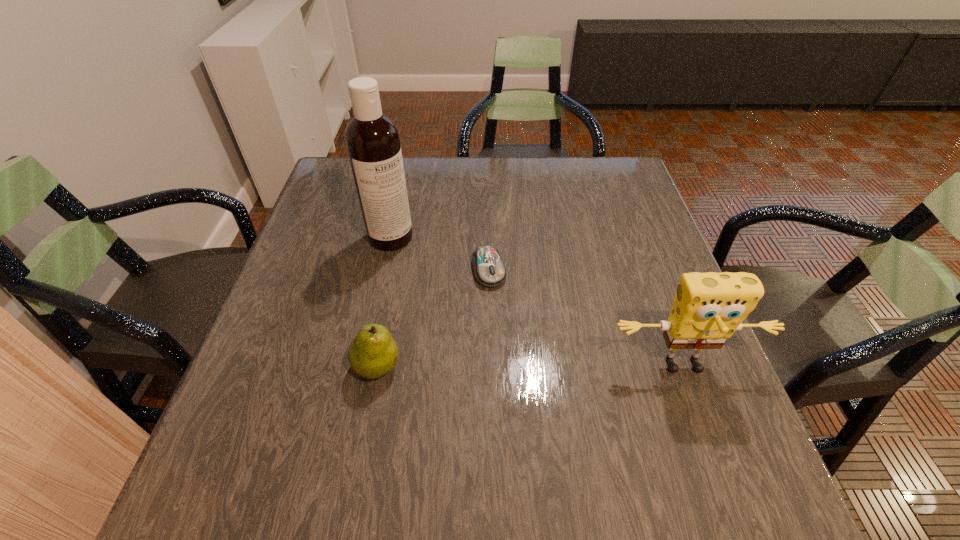
Where is `vacant space on the desktop that is between the third tallest object and the third shortest object and is positioned on the label side of the tallest object`? vacant space on the desktop that is between the third tallest object and the third shortest object and is positioned on the label side of the tallest object is located at coordinates (539, 367).

Identify the location of free spot on the desktop that is between the pear and the rightmost object and is positioned on the wheel side of the second object from right to left. (519, 367).